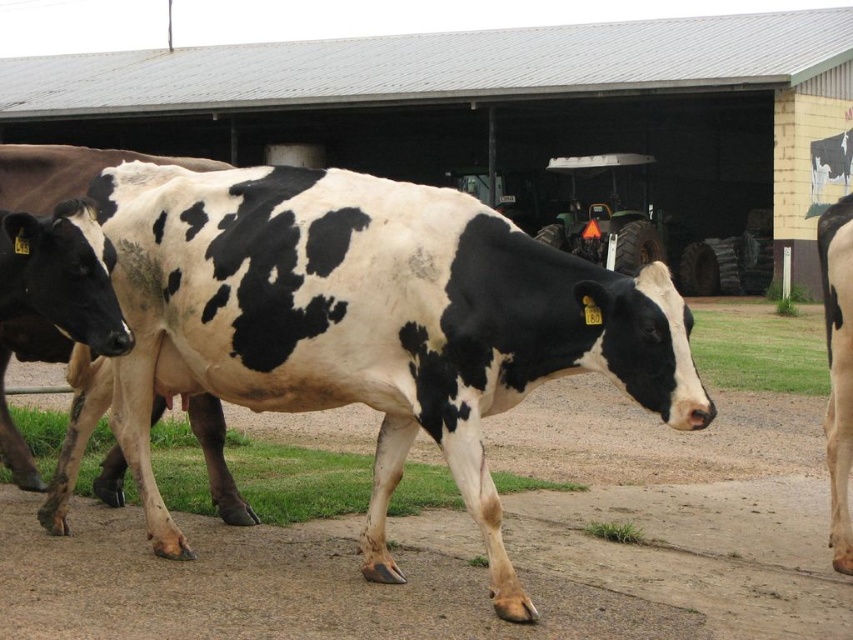
You are standing at the center of the dirt path in this farm scene. There is a point marked at coordinates (364,324). What object is located at this point?

The point at coordinates (364,324) marks the location of the black and white spotted cow at center.

Based on the scene description, what are the coordinates of the black and white spotted cow at center?

The coordinates of the black and white spotted cow at center are at point (364,324).

You are standing in the farm scene and want to determine which of the two points, point [315,276] or point [666,161], is nearer to you. Based on the image, which point is closer?

Point [315,276] is closer to the camera than point [666,161], so it is the nearer one.